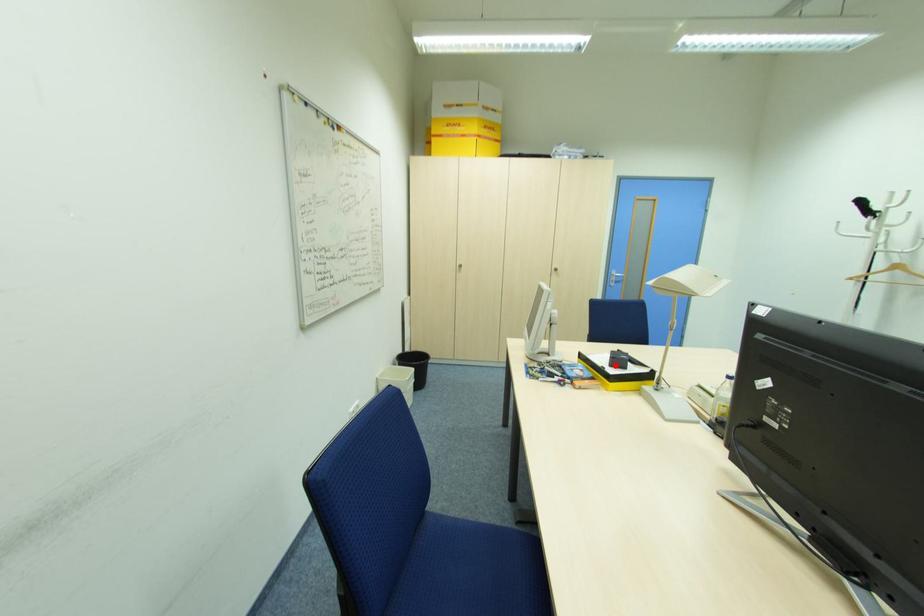
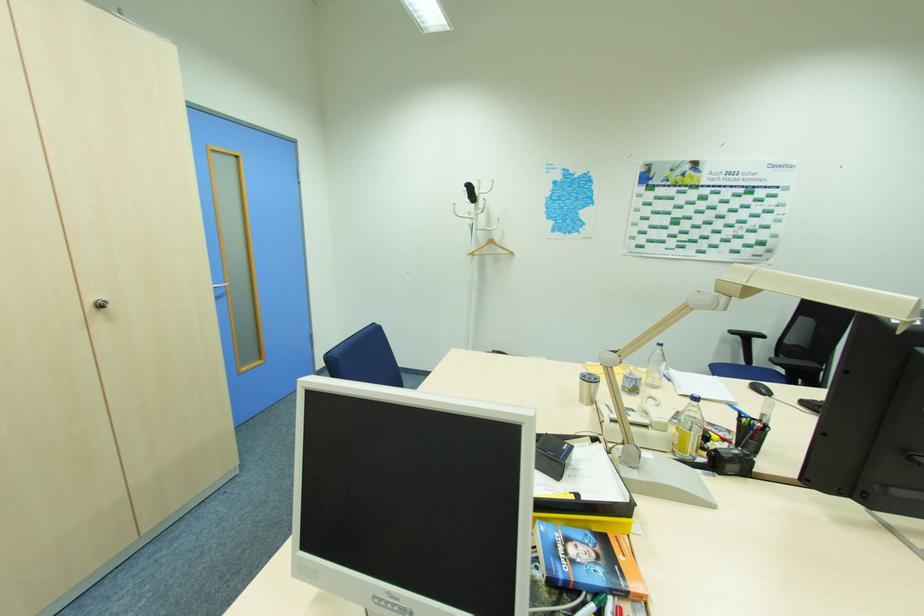
Where in the second image is the point corresponding to the highlighted location from the first image?

(561, 476)